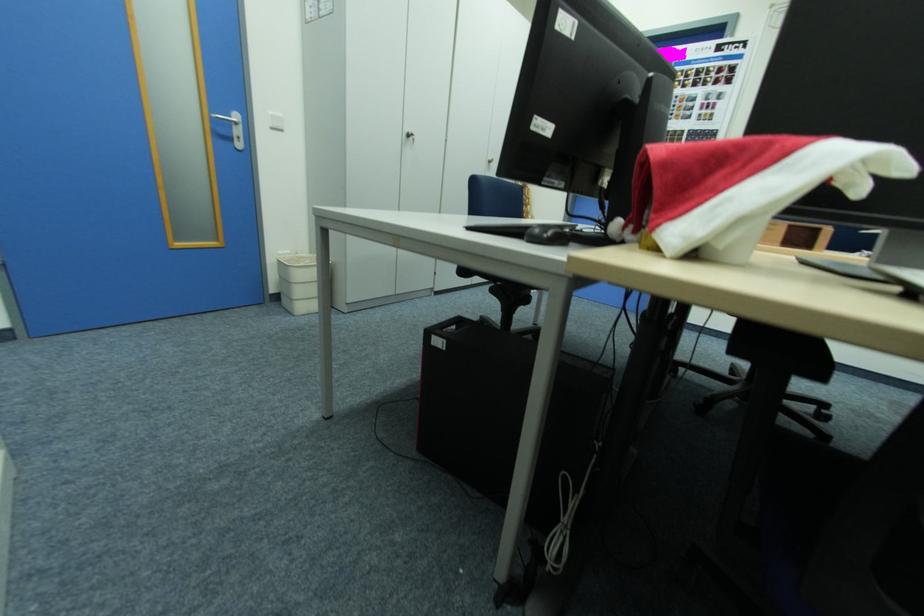
Locate an element on the screen. The image size is (924, 616). black computer mouse is located at coordinates (548, 233).